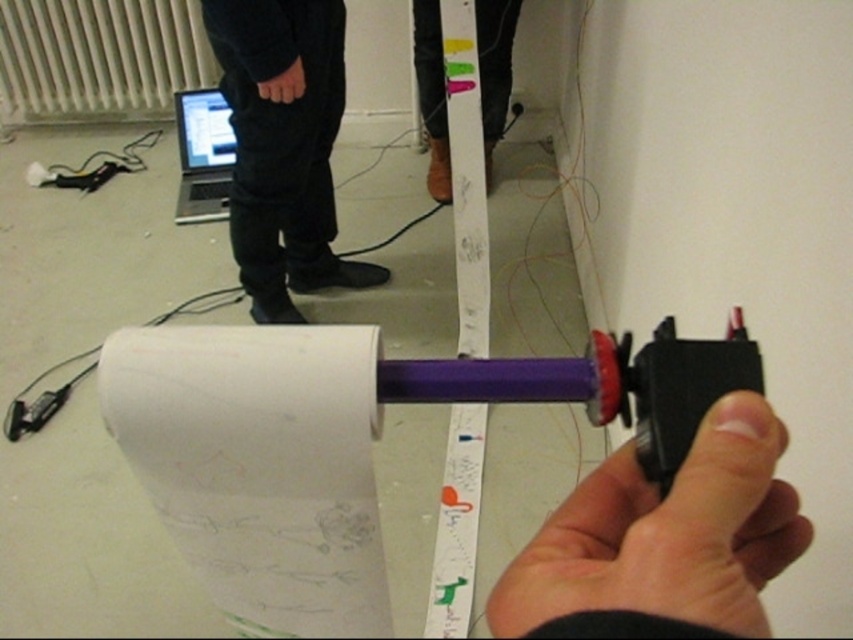
Which is below, white paper at center or silver metallic laptop at upper left?

Positioned lower is white paper at center.

What do you see at coordinates (259, 465) in the screenshot? I see `white paper at center` at bounding box center [259, 465].

Where is `white paper at center`? The width and height of the screenshot is (853, 640). white paper at center is located at coordinates (259, 465).

Can you confirm if black fabric pants at center is shorter than silver metallic laptop at upper left?

In fact, black fabric pants at center may be taller than silver metallic laptop at upper left.

Between black fabric pants at center and silver metallic laptop at upper left, which one has more height?

Standing taller between the two is black fabric pants at center.

Between point (265, 196) and point (230, 164), which one is positioned in front?

Positioned in front is point (265, 196).

Where is `black fabric pants at center`? black fabric pants at center is located at coordinates (283, 147).

Is white textured radiator at upper left positioned at the back of silver metallic laptop at upper left?

Yes, white textured radiator at upper left is further from the viewer.

Can you confirm if white textured radiator at upper left is positioned above silver metallic laptop at upper left?

Yes.

What do you see at coordinates (99, 58) in the screenshot? This screenshot has height=640, width=853. I see `white textured radiator at upper left` at bounding box center [99, 58].

Find the location of a particular element. white textured radiator at upper left is located at coordinates (99, 58).